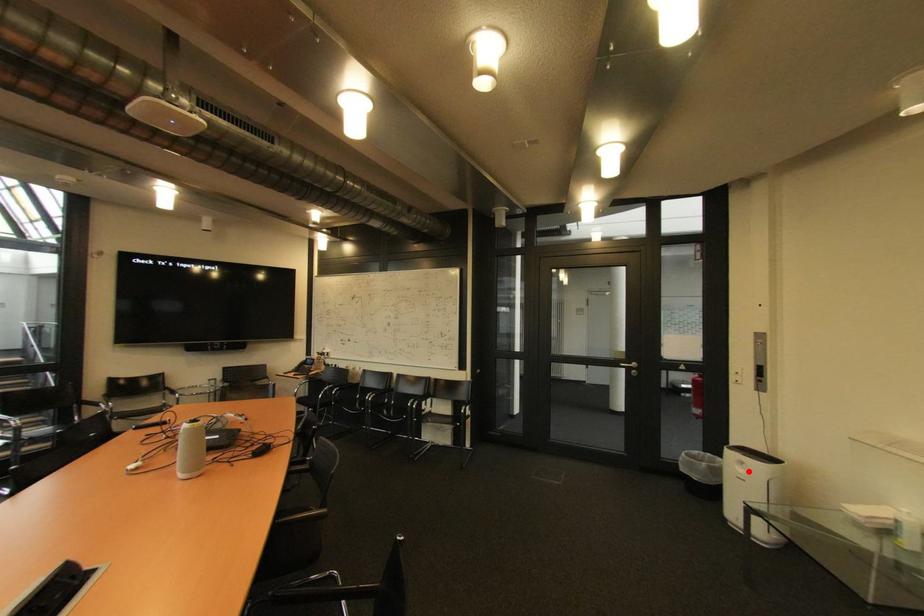
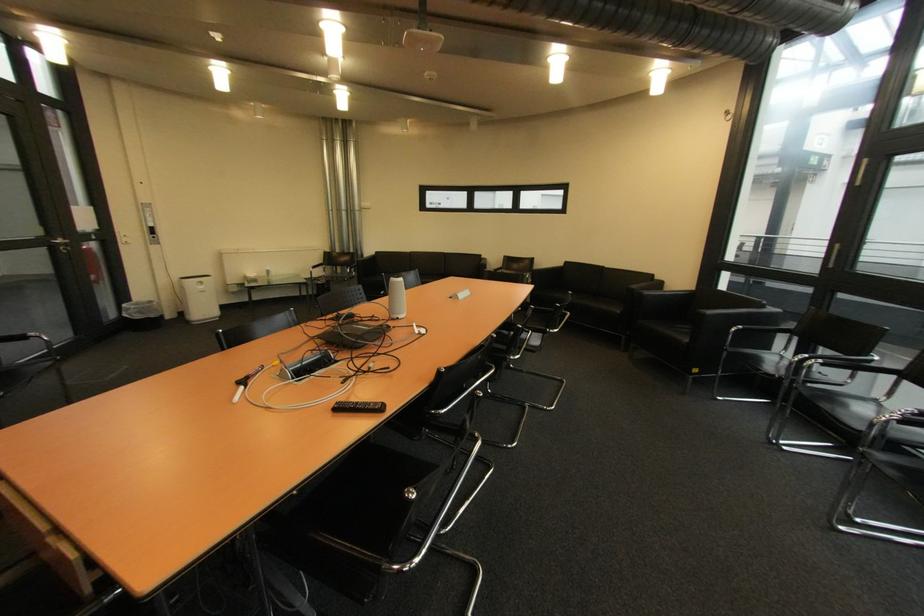
Question: I am providing you with two images of the same scene from different viewpoints. Given a red point in image1, look at the same physical point in image2. Is it:

Choices:
 (A) Closer to the viewpoint
 (B) Farther from the viewpoint

Answer: (A)